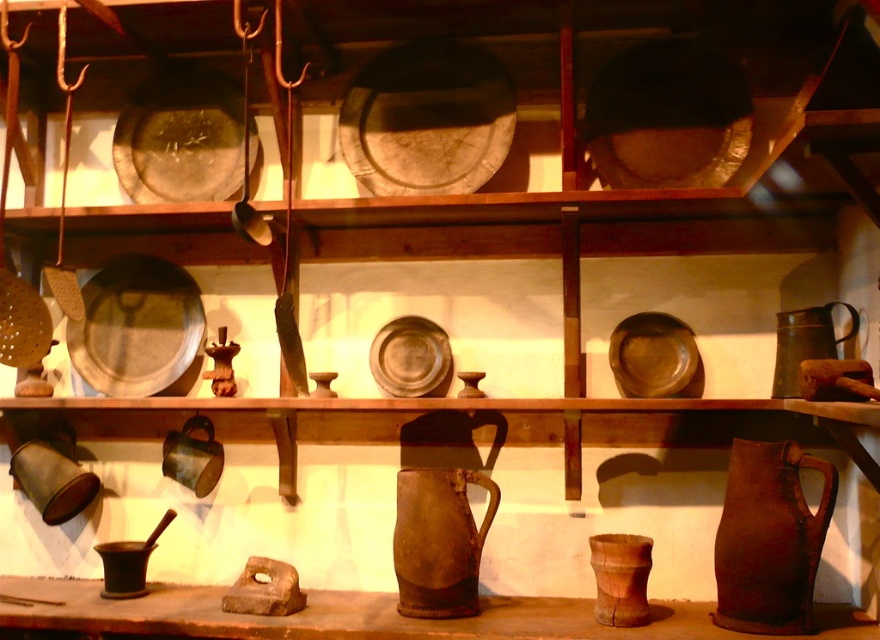
You are preparing to pour liquid from the green matte jug at right into the brown wooden cup at lower center. Based on their positions, will the liquid flow into the cup without spilling?

Yes, the liquid will flow into the brown wooden cup at lower center without spilling because the brown wooden cup at lower center is positioned directly under the green matte jug at right, allowing the liquid to pour straight down into it.

Consider the image. You are organizing a rustic kitchen display and need to place the brown wooden cup at lower center and the green matte jug at right on a shelf. The shelf has a width of 15 cm. Can both items fit side by side without overlapping?

The brown wooden cup at lower center has a lesser width compared to green matte jug at right. Since the shelf is 15 cm wide, and the cup is narrower than the jug, it depends on their combined widths. However, the description only states the cup is narrower, not the exact dimensions. Without knowing the exact widths, we cannot confirm if both will fit.